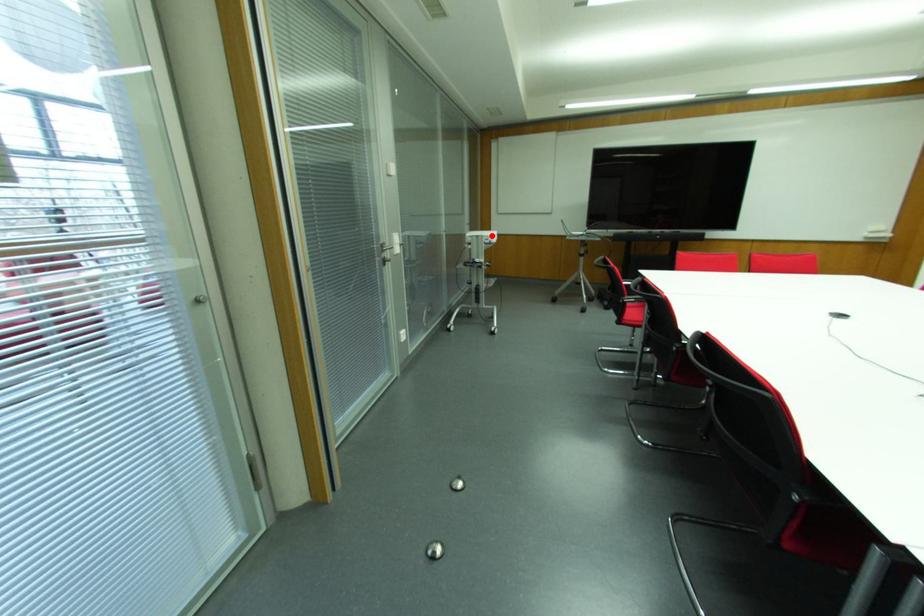
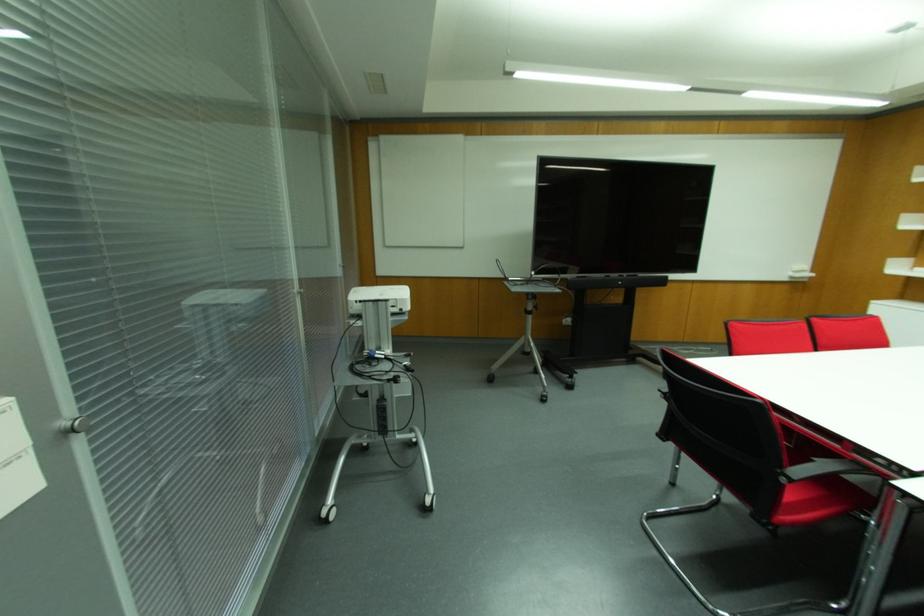
Question: I am providing you with two images of the same scene from different viewpoints. Given a red point in image1, look at the same physical point in image2. Is it:

Choices:
 (A) Closer to the viewpoint
 (B) Farther from the viewpoint

Answer: (B)